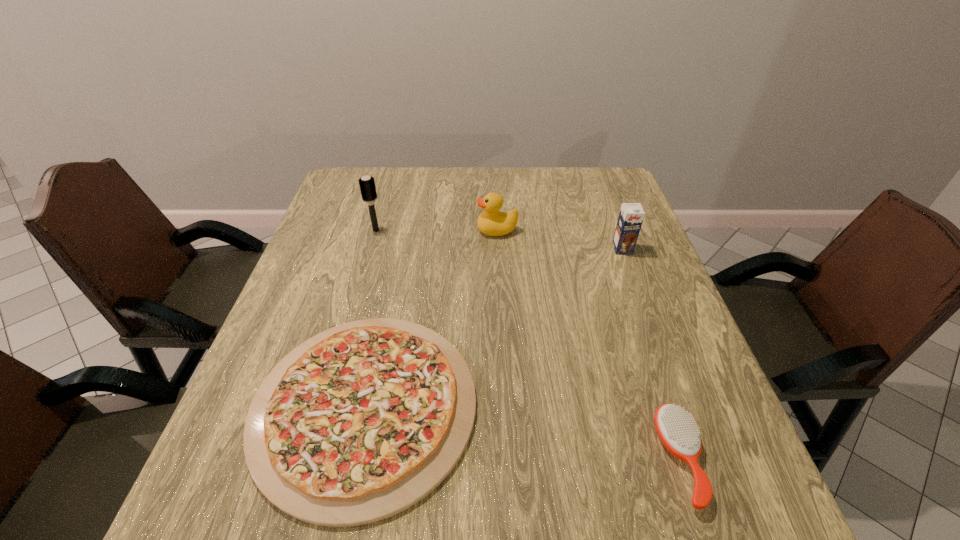
Find the location of a particular element. The image size is (960, 540). vacant space that's between the chocolate milk and the taller hairbrush is located at coordinates (499, 240).

Image resolution: width=960 pixels, height=540 pixels. In order to click on free space between the duck and the left hairbrush in this screenshot , I will do `click(437, 230)`.

I want to click on empty location between the chocolate milk and the duck, so click(x=560, y=240).

You are a GUI agent. You are given a task and a screenshot of the screen. Output one action in this format:
    pyautogui.click(x=<x>, y=<y>)
    Task: Click on the vacant area that lies between the third tallest object and the fourth tallest object
    The image size is (960, 540).
    Given the screenshot: What is the action you would take?
    pyautogui.click(x=588, y=345)

Find the location of `vacant area that lies between the shortest object and the tallest object`. vacant area that lies between the shortest object and the tallest object is located at coordinates (371, 318).

Locate an element on the screen. This screenshot has height=540, width=960. vacant space that is in between the taller hairbrush and the duck is located at coordinates (437, 230).

Identify which object is the third nearest to the shortest object. Please provide its 2D coordinates. Your answer should be formatted as a tuple, i.e. [(x, y)], where the tuple contains the x and y coordinates of a point satisfying the conditions above.

[(367, 185)]

Locate an element on the screen. This screenshot has height=540, width=960. object that is the second closest to the second shortest object is located at coordinates (631, 215).

You are a GUI agent. You are given a task and a screenshot of the screen. Output one action in this format:
    pyautogui.click(x=<x>, y=<y>)
    Task: Click on the free spot that satisfies the following two spatial constraints: 1. on the front side of the shortest object; 2. on the right side of the second shortest object
    This screenshot has height=540, width=960.
    Given the screenshot: What is the action you would take?
    pyautogui.click(x=354, y=459)

Identify the location of vacant space that satisfies the following two spatial constraints: 1. at the beak of the duck; 2. on the right side of the nearer hairbrush. The width and height of the screenshot is (960, 540). (508, 459).